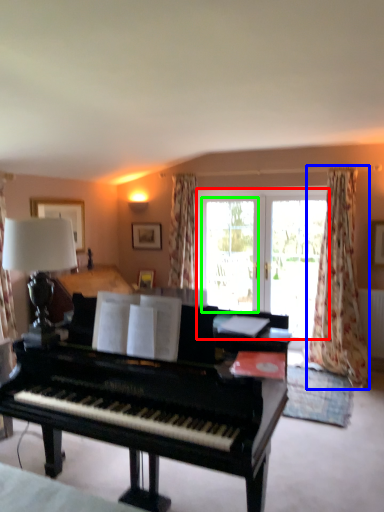
Question: Which object is the farthest from bay window (highlighted by a red box)? Choose among these: curtain (highlighted by a blue box) or screen door (highlighted by a green box).

Choices:
 (A) curtain
 (B) screen door

Answer: (A)